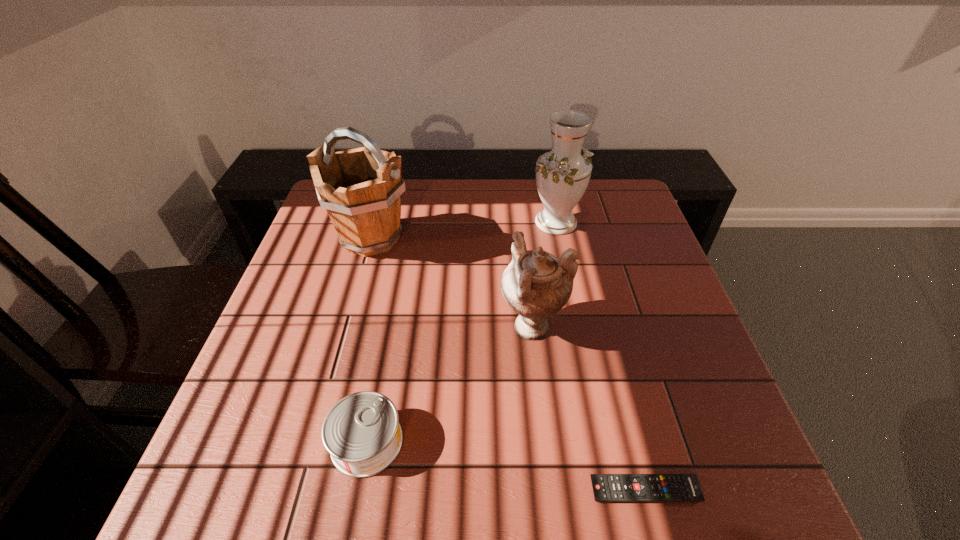
Find the location of a particular element. The image size is (960, 540). free space located on the left of the remote control is located at coordinates (522, 490).

You are a GUI agent. You are given a task and a screenshot of the screen. Output one action in this format:
    pyautogui.click(x=<x>, y=<y>)
    Task: Click on the bucket positioned at the far edge
    This screenshot has width=960, height=540.
    Given the screenshot: What is the action you would take?
    pyautogui.click(x=361, y=188)

You are a GUI agent. You are given a task and a screenshot of the screen. Output one action in this format:
    pyautogui.click(x=<x>, y=<y>)
    Task: Click on the vase at the far edge
    This screenshot has height=540, width=960.
    Given the screenshot: What is the action you would take?
    pyautogui.click(x=562, y=175)

Image resolution: width=960 pixels, height=540 pixels. I want to click on can that is at the near edge, so [362, 433].

Find the location of a particular element. remote control at the near edge is located at coordinates (606, 487).

Locate an element on the screen. The width and height of the screenshot is (960, 540). object present at the left edge is located at coordinates (361, 188).

Find the location of a particular element. This screenshot has width=960, height=540. object located at the right edge is located at coordinates (606, 487).

Locate an element on the screen. object that is at the far left corner is located at coordinates (361, 188).

Locate an element on the screen. Image resolution: width=960 pixels, height=540 pixels. object at the near right corner is located at coordinates (606, 487).

The width and height of the screenshot is (960, 540). In order to click on free spot at the far edge of the desktop in this screenshot , I will do `click(429, 185)`.